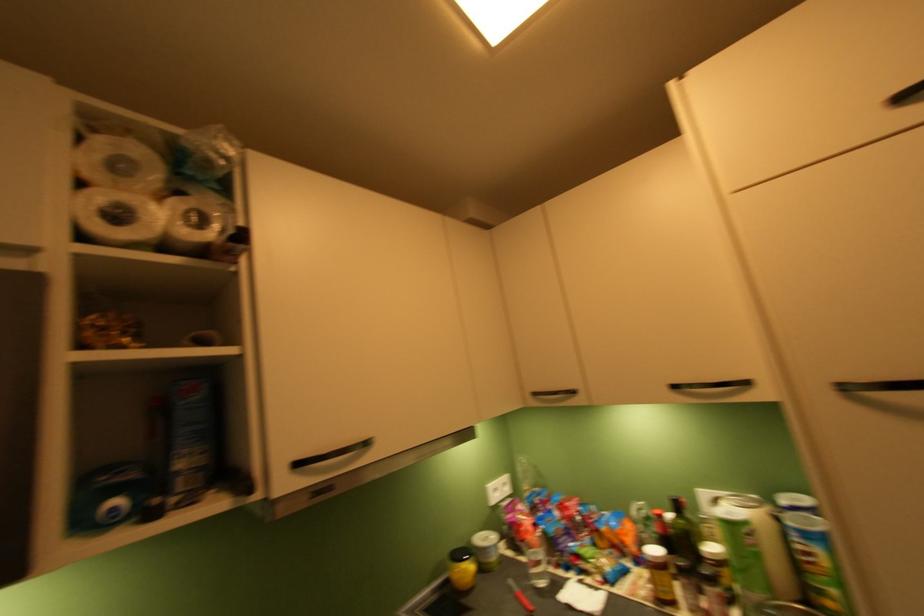
Where is `green glass bottle`? The width and height of the screenshot is (924, 616). green glass bottle is located at coordinates (743, 554).